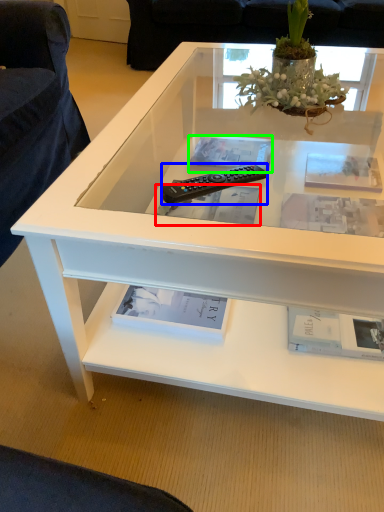
Question: Which object is positioned farthest from book (highlighted by a red box)? Select from remote control (highlighted by a blue box) and book (highlighted by a green box).

Choices:
 (A) remote control
 (B) book

Answer: (A)